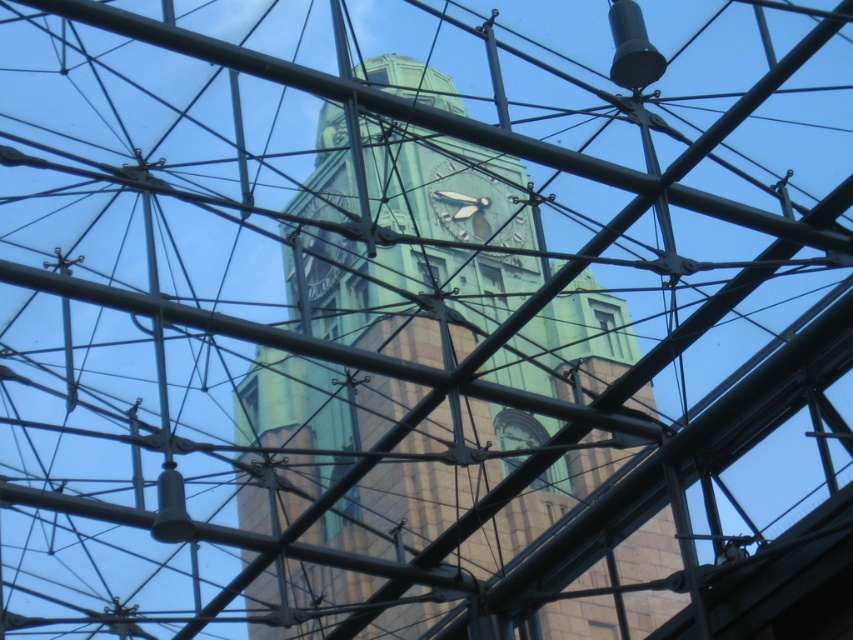
Question: Can you confirm if green metallic clock tower at center is positioned to the right of green stone clock at center?

Choices:
 (A) yes
 (B) no

Answer: (B)

Question: Which point appears farthest from the camera in this image?

Choices:
 (A) (281, 365)
 (B) (432, 202)

Answer: (B)

Question: Which point is farther to the camera?

Choices:
 (A) (508, 221)
 (B) (515, 289)

Answer: (B)

Question: Is green metallic clock tower at center smaller than green stone clock at center?

Choices:
 (A) yes
 (B) no

Answer: (B)

Question: Which point is closer to the camera taking this photo?

Choices:
 (A) (474, 195)
 (B) (538, 276)

Answer: (B)

Question: Does green metallic clock tower at center appear on the left side of green stone clock at center?

Choices:
 (A) yes
 (B) no

Answer: (A)